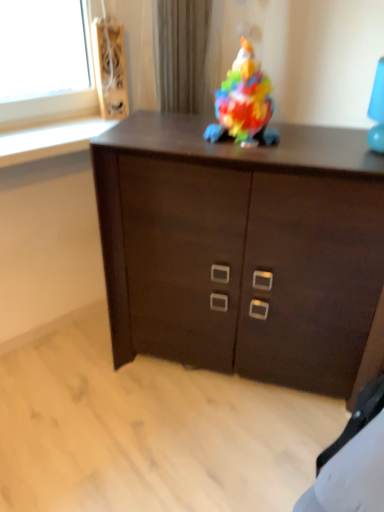
Question: Should I look upward or downward to see dark wood cabinet at center?

Choices:
 (A) down
 (B) up

Answer: (A)

Question: Is dark wood cabinet at center positioned in front of wooden speaker at upper left?

Choices:
 (A) yes
 (B) no

Answer: (A)

Question: Could you tell me if dark wood cabinet at center is facing wooden speaker at upper left?

Choices:
 (A) no
 (B) yes

Answer: (A)

Question: Would you say dark wood cabinet at center contains wooden speaker at upper left?

Choices:
 (A) yes
 (B) no

Answer: (B)

Question: Does dark wood cabinet at center have a lesser height compared to wooden speaker at upper left?

Choices:
 (A) no
 (B) yes

Answer: (A)

Question: From the image's perspective, does dark wood cabinet at center appear higher than wooden speaker at upper left?

Choices:
 (A) no
 (B) yes

Answer: (A)

Question: Is dark wood cabinet at center positioned far away from wooden speaker at upper left?

Choices:
 (A) no
 (B) yes

Answer: (A)

Question: Considering the relative positions of multicolored plastic toy at center and wooden speaker at upper left in the image provided, is multicolored plastic toy at center to the left of wooden speaker at upper left from the viewer's perspective?

Choices:
 (A) no
 (B) yes

Answer: (A)

Question: Considering the relative sizes of multicolored plastic toy at center and wooden speaker at upper left in the image provided, is multicolored plastic toy at center thinner than wooden speaker at upper left?

Choices:
 (A) yes
 (B) no

Answer: (B)

Question: Can you confirm if multicolored plastic toy at center is wider than wooden speaker at upper left?

Choices:
 (A) yes
 (B) no

Answer: (A)

Question: Is multicolored plastic toy at center aimed at wooden speaker at upper left?

Choices:
 (A) yes
 (B) no

Answer: (B)

Question: Is multicolored plastic toy at center positioned with its back to wooden speaker at upper left?

Choices:
 (A) no
 (B) yes

Answer: (A)

Question: Does multicolored plastic toy at center come in front of wooden speaker at upper left?

Choices:
 (A) no
 (B) yes

Answer: (B)

Question: Is multicolored plastic toy at center oriented towards dark wood cabinet at center?

Choices:
 (A) yes
 (B) no

Answer: (B)